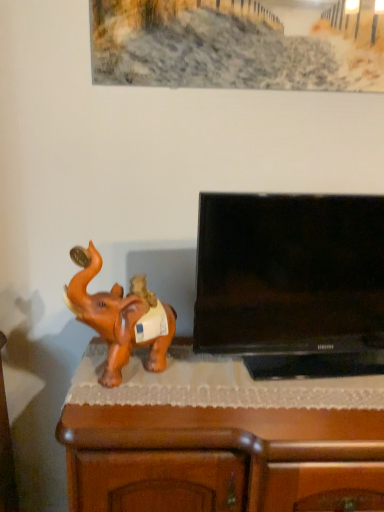
Locate an element on the screen. This screenshot has width=384, height=512. vacant area that lies to the right of brown glossy elephant at left is located at coordinates (195, 391).